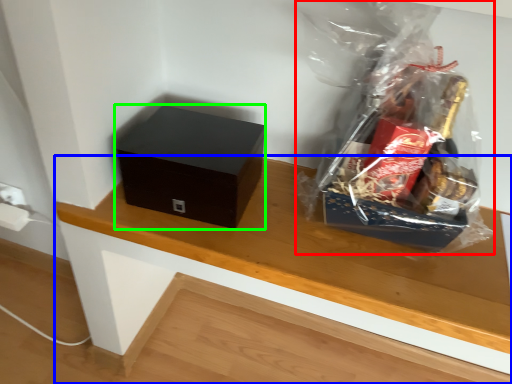
Question: Which is nearer to the plastic bag (highlighted by a red box)? table (highlighted by a blue box) or box (highlighted by a green box).

Choices:
 (A) table
 (B) box

Answer: (A)